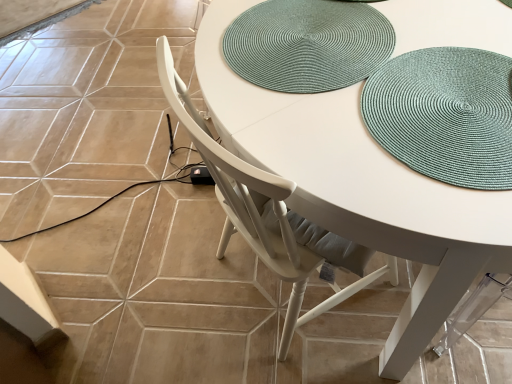
This screenshot has height=384, width=512. Find the location of `blank space above teal woven placemat at upper right (from a real-world perspective)`. blank space above teal woven placemat at upper right (from a real-world perspective) is located at coordinates (445, 107).